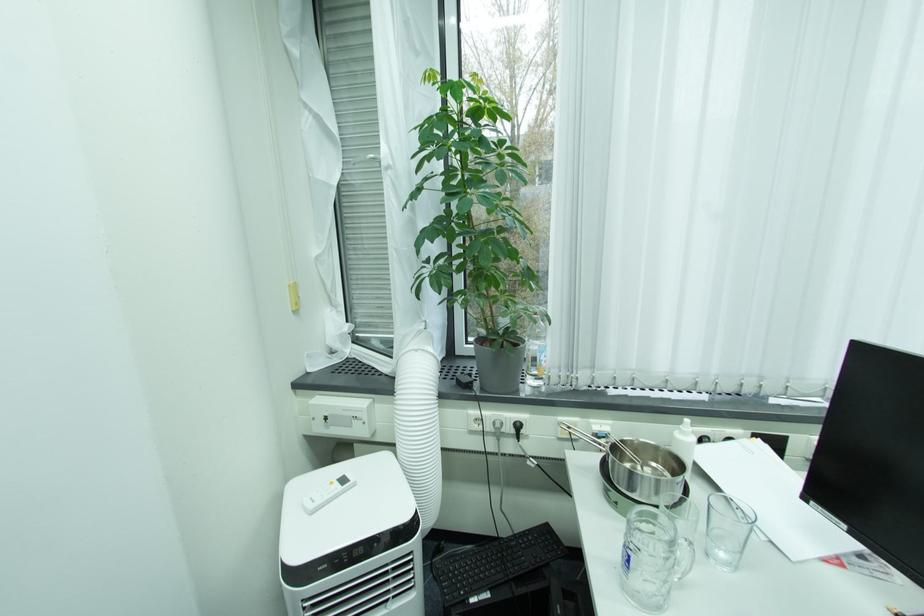
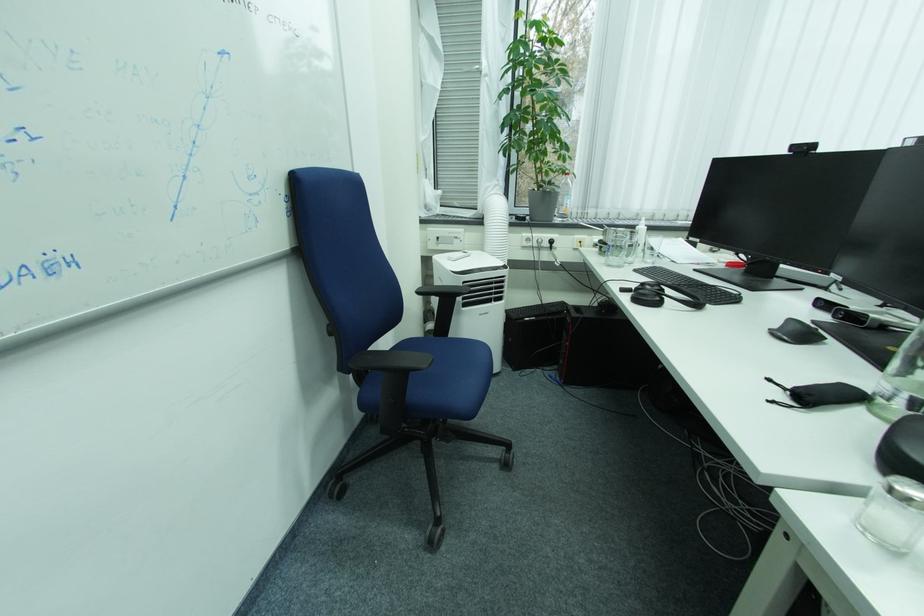
Find the pixel in the second image that matches point (476, 387) in the first image.

(530, 220)